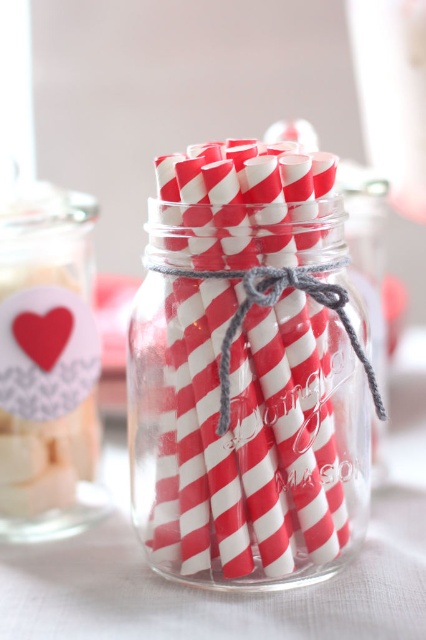
Question: Can you confirm if red striped straws at center is smaller than matte white glass jar at upper left?

Choices:
 (A) no
 (B) yes

Answer: (A)

Question: Which of these objects is positioned closest to the matte white glass jar at upper left?

Choices:
 (A) matte paper heart at center
 (B) red striped straws at center

Answer: (A)

Question: Observing the image, what is the correct spatial positioning of red striped straws at center in reference to matte white glass jar at upper left?

Choices:
 (A) below
 (B) above

Answer: (A)

Question: Which is nearer to the matte white glass jar at upper left?

Choices:
 (A) red striped straws at center
 (B) matte paper heart at center

Answer: (B)

Question: Can you confirm if matte white glass jar at upper left is thinner than matte paper heart at center?

Choices:
 (A) no
 (B) yes

Answer: (A)

Question: Based on their relative distances, which object is farther from the matte white glass jar at upper left?

Choices:
 (A) red striped straws at center
 (B) matte paper heart at center

Answer: (A)